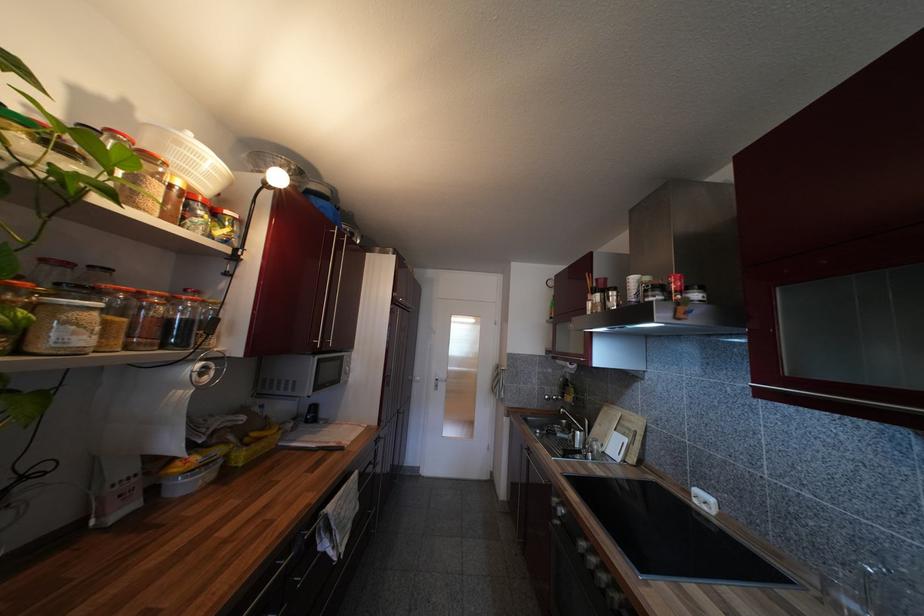
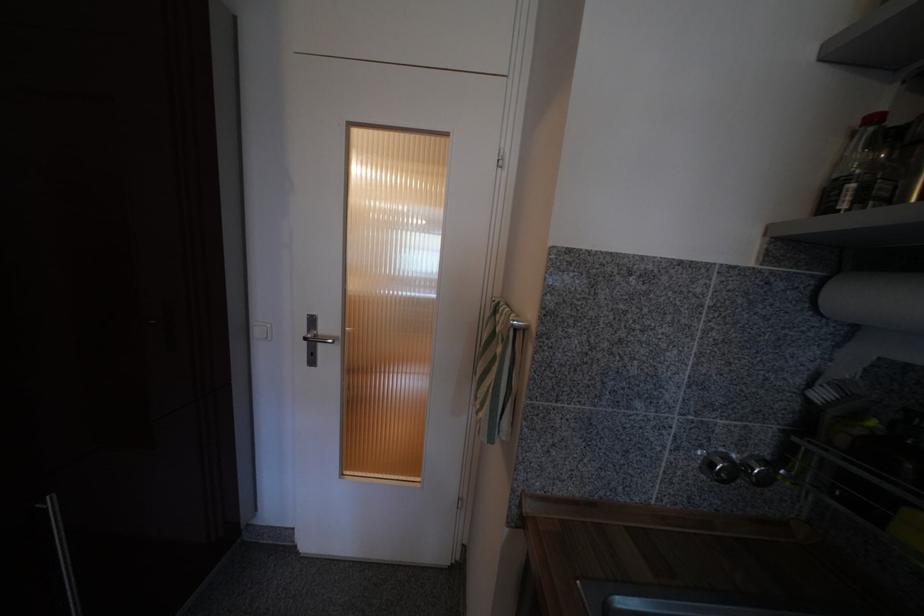
Find the pixel in the second image that matches the point at 562,400 in the first image.

(772, 482)